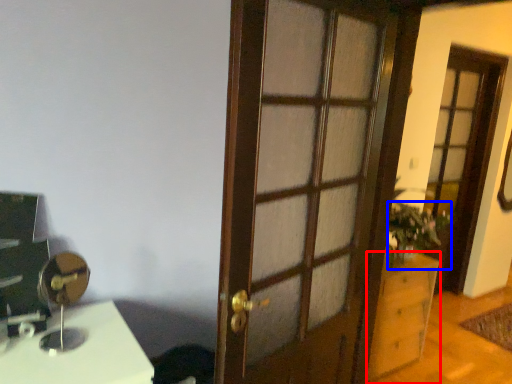
Question: Which point is closer to the camera, cabinetry (highlighted by a red box) or houseplant (highlighted by a blue box)?

Choices:
 (A) cabinetry
 (B) houseplant

Answer: (A)